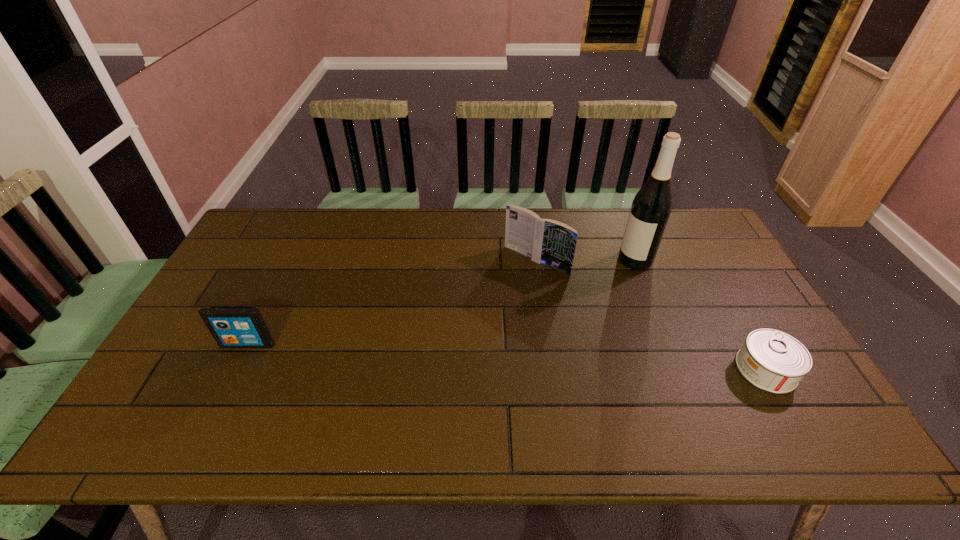
Identify the location of object at the right edge. (771, 360).

Where is `object that is at the near right corner`? Image resolution: width=960 pixels, height=540 pixels. object that is at the near right corner is located at coordinates (771, 360).

In the image, there is a desktop. At what (x,y) coordinates should I click in order to perform the action: click on free space at the far edge. Please return your answer as a coordinate pair (x, y). The image size is (960, 540). Looking at the image, I should click on (540, 208).

Image resolution: width=960 pixels, height=540 pixels. In the image, there is a desktop. Find the location of `free space at the near edge`. free space at the near edge is located at coordinates 651,407.

I want to click on free space at the right edge of the desktop, so click(x=679, y=258).

You are a GUI agent. You are given a task and a screenshot of the screen. Output one action in this format:
    pyautogui.click(x=<x>, y=<y>)
    Task: Click on the blank space at the far left corner
    The image size is (960, 540).
    Given the screenshot: What is the action you would take?
    pyautogui.click(x=291, y=211)

What are the coordinates of `free space between the iPod and the second tallest object` in the screenshot? It's located at (392, 302).

In order to click on unoccupied area between the tallest object and the shortest object in this screenshot , I will do `click(701, 315)`.

Locate an element on the screen. free space between the iPod and the rightmost object is located at coordinates (507, 356).

At what (x,y) coordinates should I click in order to perform the action: click on free area in between the third object from left to right and the can. Please return your answer as a coordinate pair (x, y). This screenshot has width=960, height=540. Looking at the image, I should click on (701, 315).